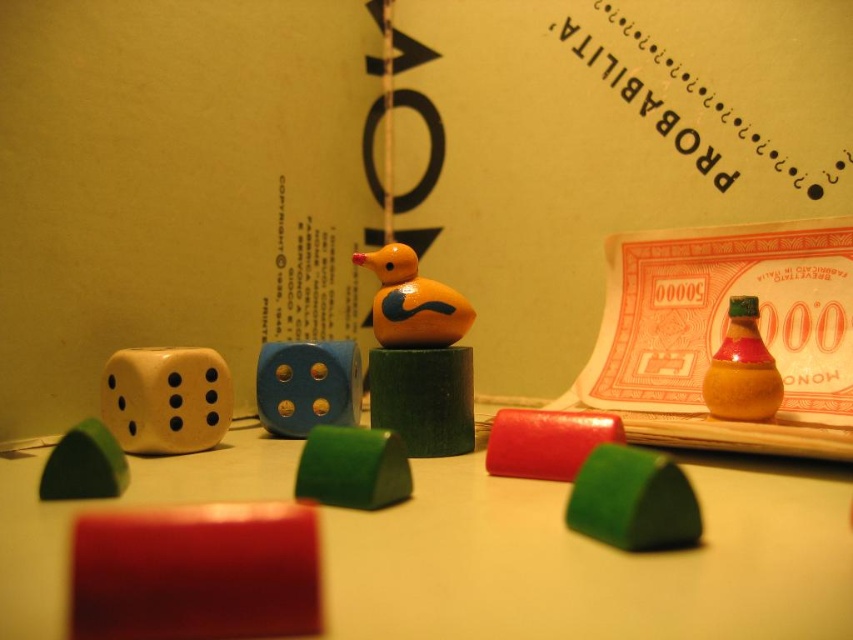
Question: Is wooden blocks at center to the left of green matte triangle at center from the viewer's perspective?

Choices:
 (A) yes
 (B) no

Answer: (B)

Question: Which object appears farthest from the camera in this image?

Choices:
 (A) rubberized red block at center
 (B) matte orange bottle at center right
 (C) wooden duck at center
 (D) green matte triangle at center

Answer: (C)

Question: Is green matte triangle at center smaller than rubberized red block at center?

Choices:
 (A) yes
 (B) no

Answer: (A)

Question: Is wooden duck at center thinner than matte orange bottle at center right?

Choices:
 (A) no
 (B) yes

Answer: (A)

Question: Estimate the real-world distances between objects in this image. Which object is closer to the yellow matte dice at left?

Choices:
 (A) green matte triangle at center
 (B) blue matte dice at center
 (C) wooden blocks at center

Answer: (B)

Question: Among these points, which one is nearest to the camera?

Choices:
 (A) (762, 410)
 (B) (605, 524)
 (C) (564, 637)

Answer: (C)